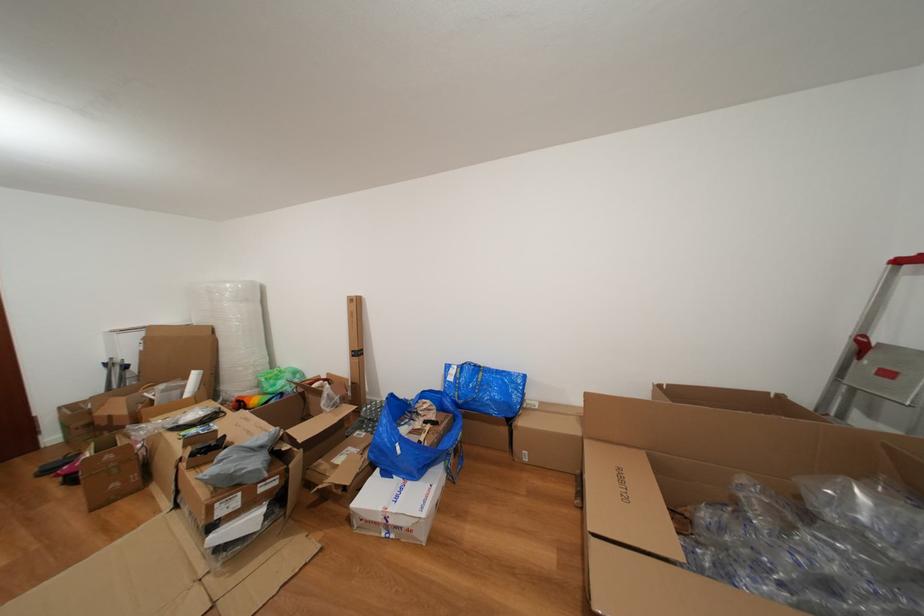
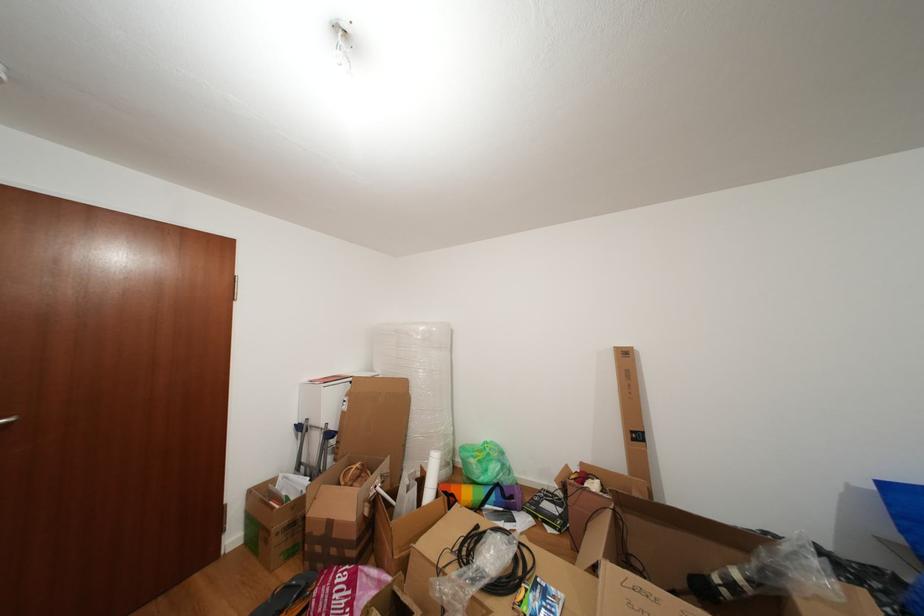
Question: I am providing you with two images of the same scene from different viewpoints. Which of the following objects are not visible in image2?

Choices:
 (A) green and brown box
 (B) open cardboard box
 (C) taped cardboard box
 (D) none of these

Answer: (D)